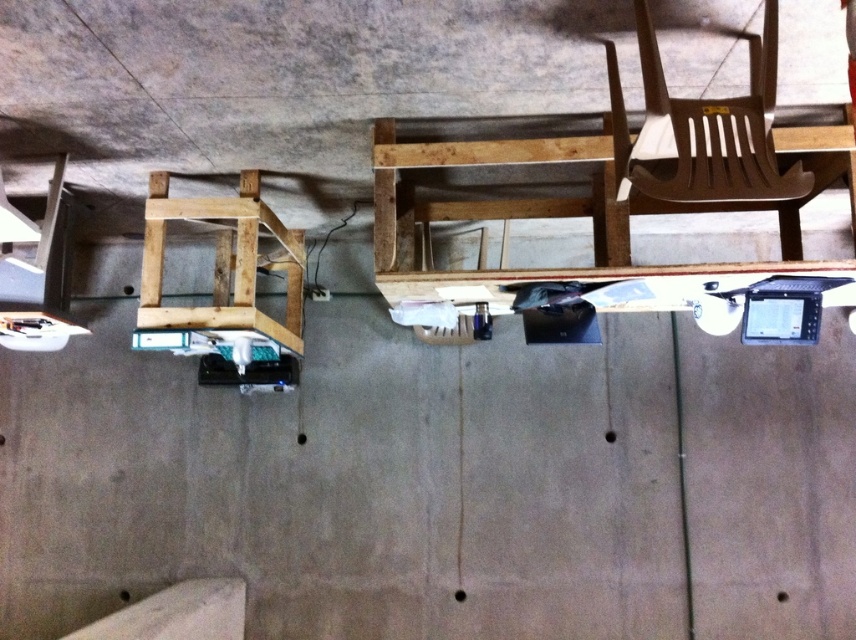
Is natural wood stool at left smaller than white matte ramp at lower left?

Actually, natural wood stool at left might be larger than white matte ramp at lower left.

Does natural wood stool at left appear over white matte ramp at lower left?

Correct, natural wood stool at left is located above white matte ramp at lower left.

At what (x,y) coordinates should I click in order to perform the action: click on natural wood stool at left. Please return your answer as a coordinate pair (x, y). Looking at the image, I should click on (223, 264).

Who is shorter, mahogany wood chair at upper right or white matte ramp at lower left?

Answer: Standing shorter between the two is white matte ramp at lower left.

Is mahogany wood chair at upper right smaller than white matte ramp at lower left?

Yes.

This screenshot has width=856, height=640. Describe the element at coordinates (703, 131) in the screenshot. I see `mahogany wood chair at upper right` at that location.

At what (x,y) coordinates should I click in order to perform the action: click on mahogany wood chair at upper right. Please return your answer as a coordinate pair (x, y). Looking at the image, I should click on (703, 131).

Can you confirm if mahogany wood chair at upper right is bigger than natural wood stool at left?

Incorrect, mahogany wood chair at upper right is not larger than natural wood stool at left.

Is mahogany wood chair at upper right thinner than natural wood stool at left?

Indeed, mahogany wood chair at upper right has a lesser width compared to natural wood stool at left.

This screenshot has width=856, height=640. I want to click on mahogany wood chair at upper right, so click(x=703, y=131).